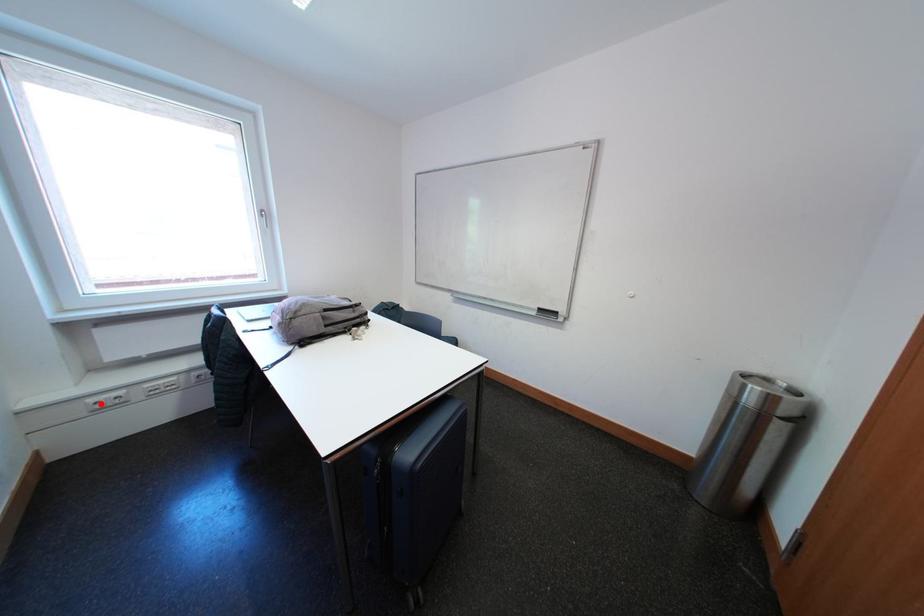
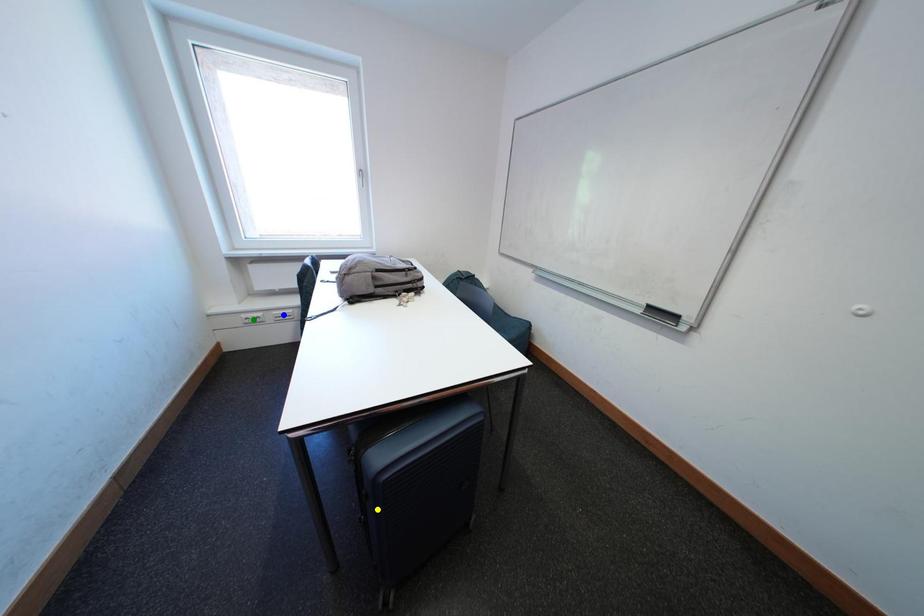
Question: I am providing you with two images of the same scene from different viewpoints. A red point is marked on the first image. You are given multiple points on the second image. In image 2, which mark is for the same physical point as the one in image 1?

Choices:
 (A) yellow point
 (B) green point
 (C) blue point

Answer: (B)